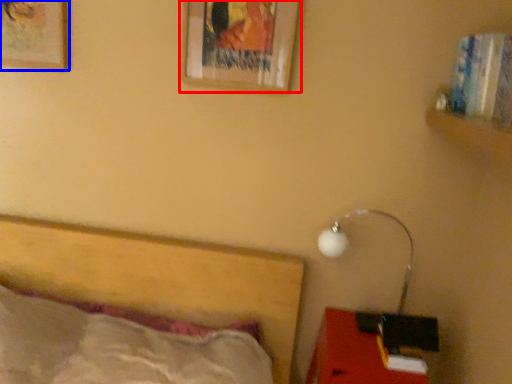
Question: Which of the following is the closest to the observer, picture frame (highlighted by a red box) or picture frame (highlighted by a blue box)?

Choices:
 (A) picture frame
 (B) picture frame

Answer: (A)